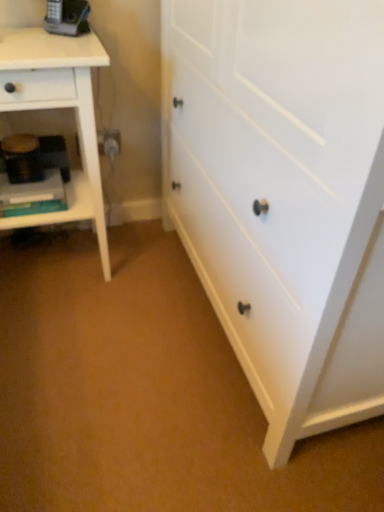
The image size is (384, 512). Identify the location of free location in front of matte black phone at upper left. (42, 47).